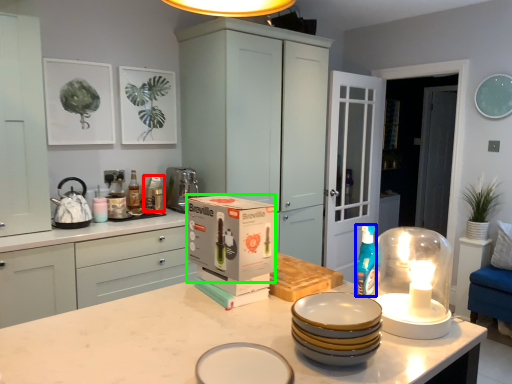
Question: Which is nearer to the appliance (highlighted by a red box)? teal (highlighted by a blue box) or cardboard box (highlighted by a green box).

Choices:
 (A) teal
 (B) cardboard box

Answer: (B)